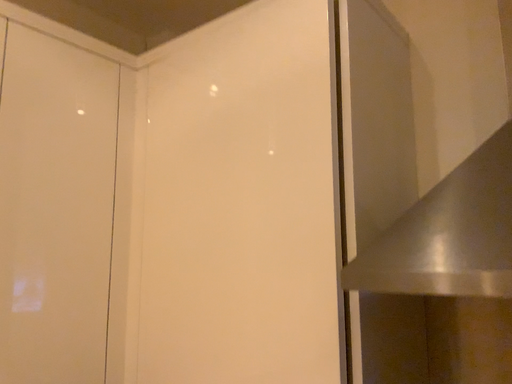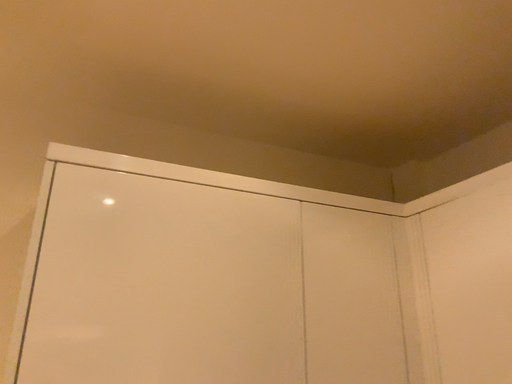
Question: Which way did the camera rotate in the video?

Choices:
 (A) rotated downward
 (B) rotated upward

Answer: (B)